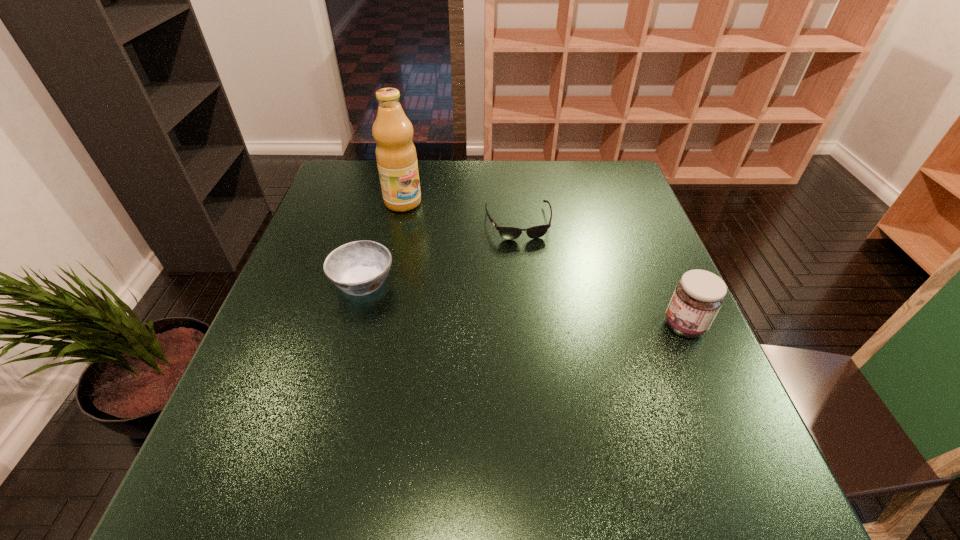
The image size is (960, 540). What are the coordinates of `vacant region between the third tallest object and the rightmost object` in the screenshot? It's located at (524, 304).

The width and height of the screenshot is (960, 540). In order to click on vacant area that lies between the third tallest object and the sunglasses in this screenshot , I will do `click(441, 252)`.

At what (x,y) coordinates should I click in order to perform the action: click on vacant area between the rightmost object and the olive oil. Please return your answer as a coordinate pair (x, y). Looking at the image, I should click on (543, 264).

The width and height of the screenshot is (960, 540). What are the coordinates of `vacant space in between the jam and the shortest object` in the screenshot? It's located at (601, 274).

Locate an element on the screen. vacant space that's between the ashtray and the nearest object is located at coordinates (524, 304).

Identify which object is the third closest to the third shortest object. Please provide its 2D coordinates. Your answer should be formatted as a tuple, i.e. [(x, y)], where the tuple contains the x and y coordinates of a point satisfying the conditions above.

[(396, 156)]

Choose which object is the nearest neighbor to the nearest object. Please provide its 2D coordinates. Your answer should be formatted as a tuple, i.e. [(x, y)], where the tuple contains the x and y coordinates of a point satisfying the conditions above.

[(510, 233)]

At what (x,y) coordinates should I click in order to perform the action: click on free region that satisfies the following two spatial constraints: 1. on the front side of the second tallest object; 2. on the front label of the shortest object. Please return your answer as a coordinate pair (x, y). The image size is (960, 540). Looking at the image, I should click on (529, 326).